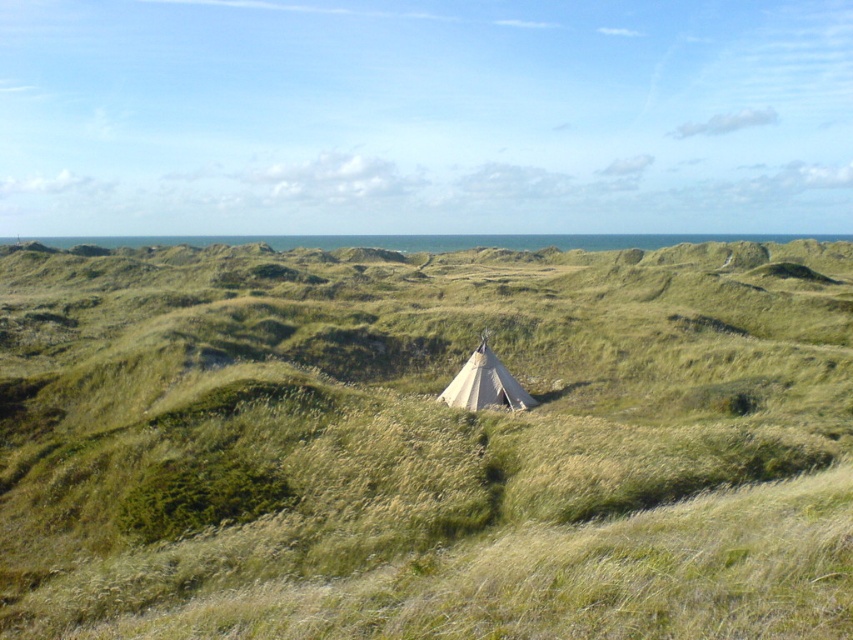
Is green grassy at center smaller than beige canvas tent at center?

No.

Is green grassy at center shorter than beige canvas tent at center?

In fact, green grassy at center may be taller than beige canvas tent at center.

Locate an element on the screen. green grassy at center is located at coordinates (425, 442).